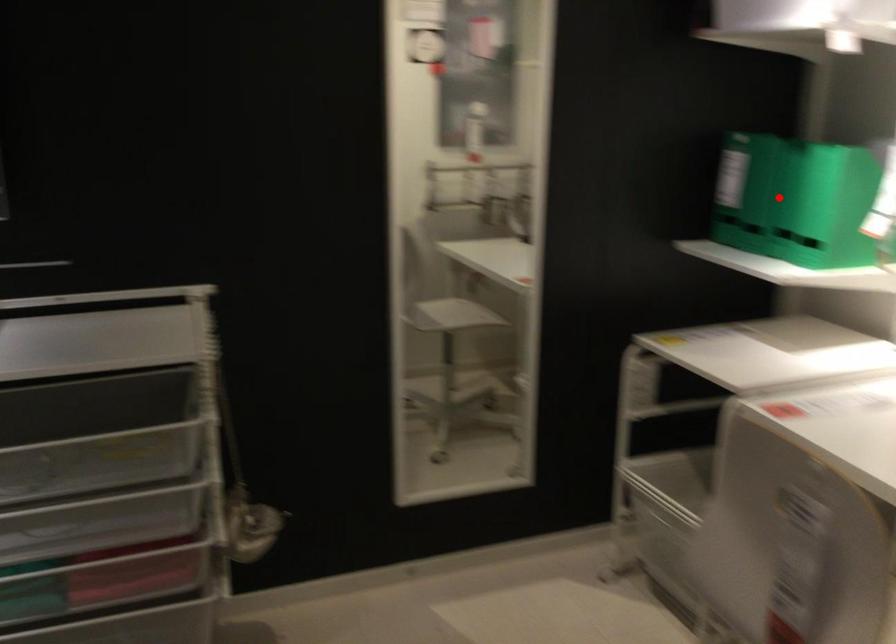
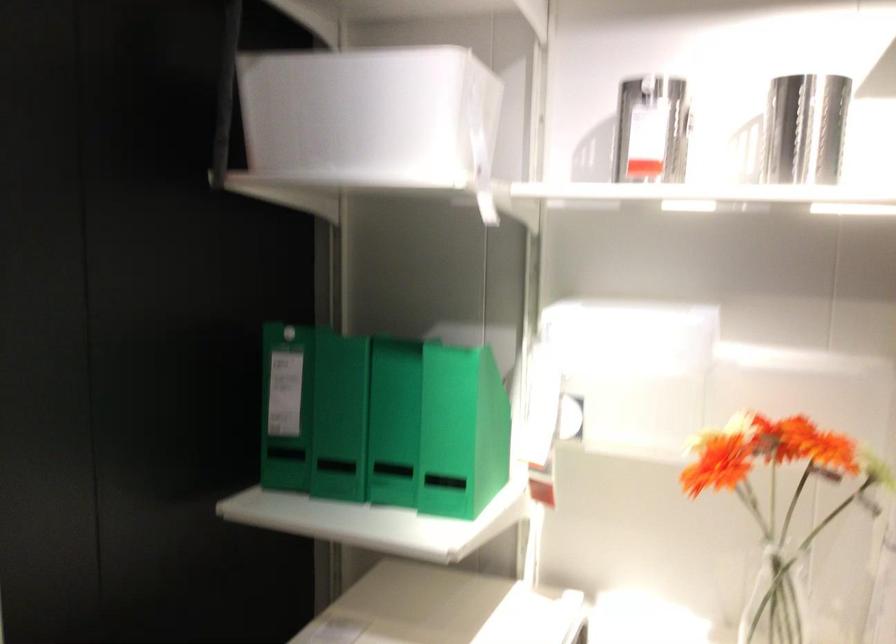
Question: I am providing you with two images of the same scene from different viewpoints. Image1 has a red point marked. In image2, the corresponding 3D location appears at what relative position? Reply with the corresponding letter.

Choices:
 (A) Closer
 (B) Farther

Answer: (A)